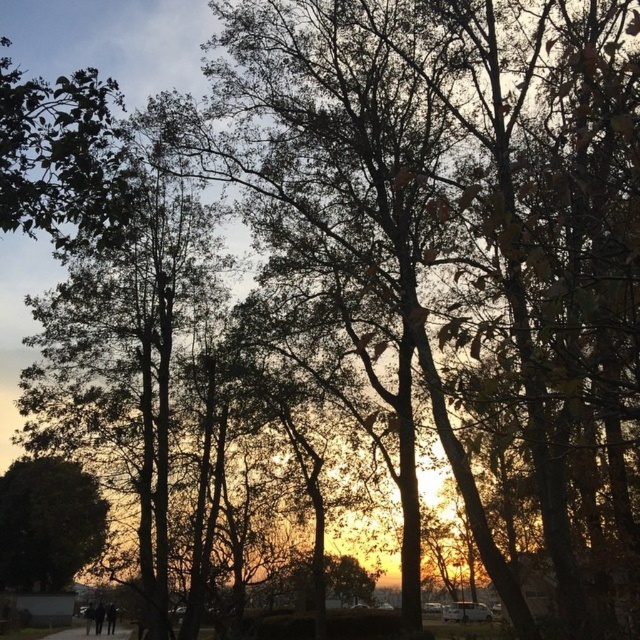
You are standing on the gravel path at lower center and want to take a photo of the green leafy tree at upper left. Considering the distance between them, can you capture the entire tree in your smartphone camera without moving closer? Please provide a yes or no answer and explain your reasoning.

The green leafy tree at upper left is 29.66 meters away from the gravel path at lower center. Most smartphones have a maximum focal length of around 100mm, which can capture distant subjects up to about 20 meters away with reasonable clarity. Since 29.66 meters exceeds this range, capturing the entire tree without moving closer would be challenging. The answer is no.

You are standing on the pathway in the scene and want to take a photo of both the green leafy tree at upper left and the green leafy tree at lower left. Which tree should you focus on first if you want to capture both in the same frame without moving your camera?

You should focus on the green leafy tree at lower left first because it is larger in size compared to the green leafy tree at upper left, allowing it to be more prominently featured while still fitting both into the frame.

You are standing at the viewpoint of the image and want to place a small flag at the closest point between point [10,100] and point [20,512]. Which point should you place the flag at?

Point [10,100] is closer to the viewer than point [20,512], so you should place the flag at point [10,100].